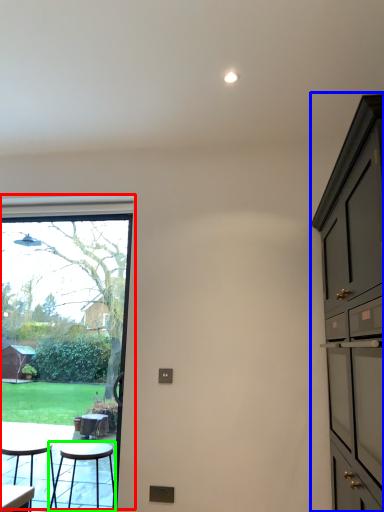
Question: Which object is positioned farthest from window (highlighted by a red box)? Select from cabinetry (highlighted by a blue box) and stool (highlighted by a green box).

Choices:
 (A) cabinetry
 (B) stool

Answer: (A)